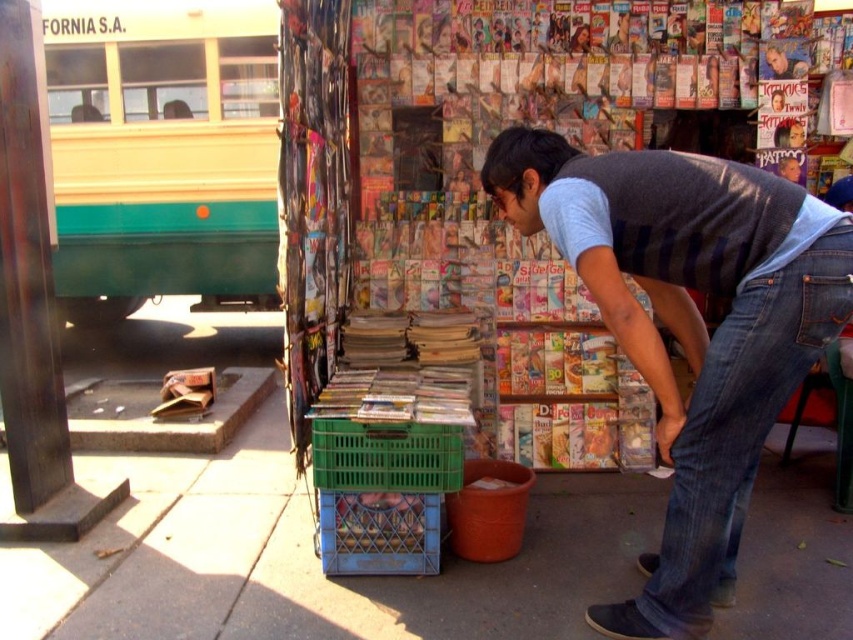
Locate an element on the screen. The width and height of the screenshot is (853, 640). teal matte bus at left is located at coordinates (161, 154).

Who is positioned more to the right, teal matte bus at left or denim at lower right?

denim at lower right

Is point (67, 157) positioned after point (772, 349)?

Yes, point (67, 157) is behind point (772, 349).

You are a GUI agent. You are given a task and a screenshot of the screen. Output one action in this format:
    pyautogui.click(x=<x>, y=<y>)
    Task: Click on the teal matte bus at left
    Image resolution: width=853 pixels, height=640 pixels.
    Given the screenshot: What is the action you would take?
    pyautogui.click(x=161, y=154)

Is denim jeans at lower right bigger than denim at lower right?

Correct, denim jeans at lower right is larger in size than denim at lower right.

How much distance is there between denim jeans at lower right and denim at lower right?

denim jeans at lower right is 5.07 inches from denim at lower right.

Where is `denim jeans at lower right`? Image resolution: width=853 pixels, height=640 pixels. denim jeans at lower right is located at coordinates (688, 326).

Is denim jeans at lower right taller than teal matte bus at left?

No, denim jeans at lower right is not taller than teal matte bus at left.

Is point (711, 508) closer to camera compared to point (144, 285)?

That is True.

Measure the distance between point [762,195] and camera.

Point [762,195] is 5.51 feet away from camera.

Where is `denim jeans at lower right`? denim jeans at lower right is located at coordinates (688, 326).